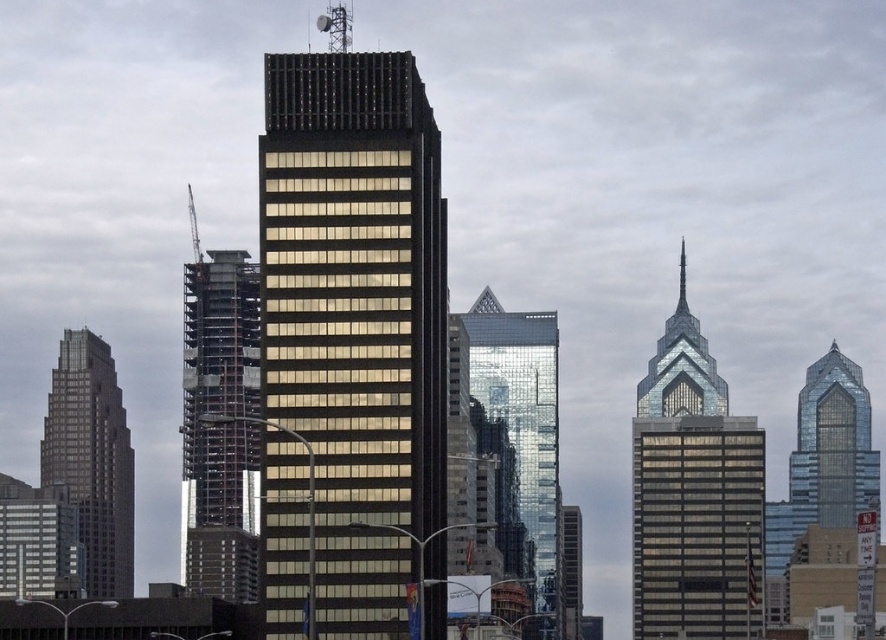
You are an urban planner assessing the city skyline. You need to determine which of the two buildings, the black glass building at center or the metallic silver construction at left, is taller. Based on the image, which one is taller?

The black glass building at center is taller than the metallic silver construction at left.

You are standing on the observation deck of the glassy reflective skyscraper at center. You want to know how far you are from the base of the building. Can you determine the distance?

The glassy reflective skyscraper at center and viewer are 2132.51 feet apart, so the distance from the observation deck to the base of the building is 2132.51 feet.